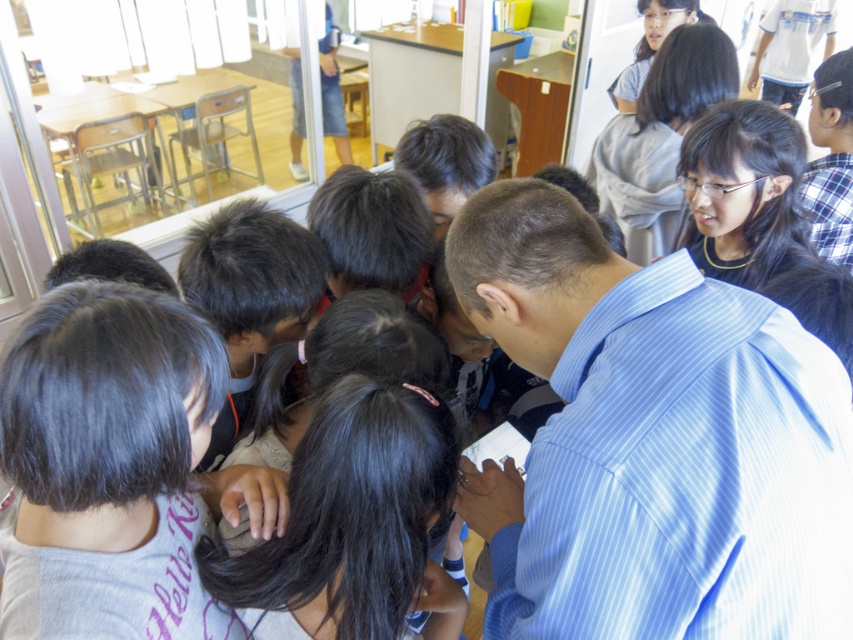
Does blue striped shirt at center appear under matte gray shirt at upper right?

Indeed, blue striped shirt at center is positioned under matte gray shirt at upper right.

Where is `blue striped shirt at center`? This screenshot has height=640, width=853. blue striped shirt at center is located at coordinates (653, 440).

Which is more to the left, blue striped shirt at center or dark gray hair at center?

From the viewer's perspective, dark gray hair at center appears more on the left side.

Does blue striped shirt at center appear on the left side of dark gray hair at center?

No, blue striped shirt at center is not to the left of dark gray hair at center.

The image size is (853, 640). I want to click on blue striped shirt at center, so click(x=653, y=440).

Which of these two, black hair at center or matte gray shirt at upper right, stands taller?

Standing taller between the two is matte gray shirt at upper right.

Who is positioned more to the right, black hair at center or matte gray shirt at upper right?

Positioned to the right is matte gray shirt at upper right.

Locate an element on the screen. The width and height of the screenshot is (853, 640). black hair at center is located at coordinates (349, 515).

This screenshot has width=853, height=640. Find the location of `black hair at center`. black hair at center is located at coordinates (349, 515).